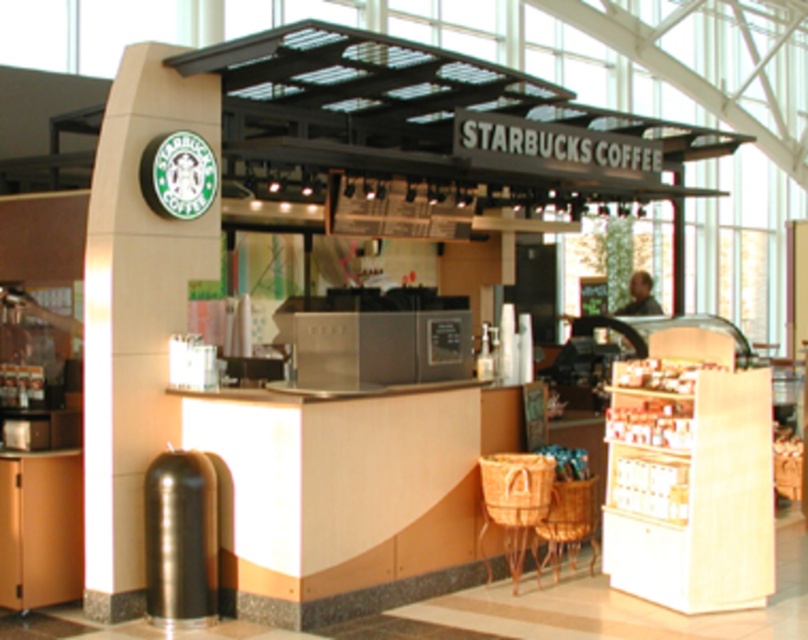
Can you confirm if metallic cylindrical trash can at left is positioned below woven wood chair at lower center?

Incorrect, metallic cylindrical trash can at left is not positioned below woven wood chair at lower center.

Which is below, metallic cylindrical trash can at left or woven wood chair at lower center?

Positioned lower is woven wood chair at lower center.

Which is in front, point (165, 234) or point (573, 497)?

Positioned in front is point (165, 234).

The height and width of the screenshot is (640, 808). I want to click on metallic cylindrical trash can at left, so click(135, 314).

Which is more to the left, metallic cylindrical trash can at left or brown woven basket at lower right?

From the viewer's perspective, metallic cylindrical trash can at left appears more on the left side.

Measure the distance between metallic cylindrical trash can at left and camera.

8.20 meters

Where is `metallic cylindrical trash can at left`? metallic cylindrical trash can at left is located at coordinates (135, 314).

Is brown woven basket at lower right below woven wood chair at lower center?

No, brown woven basket at lower right is not below woven wood chair at lower center.

Does brown woven basket at lower right lie in front of woven wood chair at lower center?

Yes, brown woven basket at lower right is closer to the viewer.

Where is `brown woven basket at lower right`? Image resolution: width=808 pixels, height=640 pixels. brown woven basket at lower right is located at coordinates (514, 500).